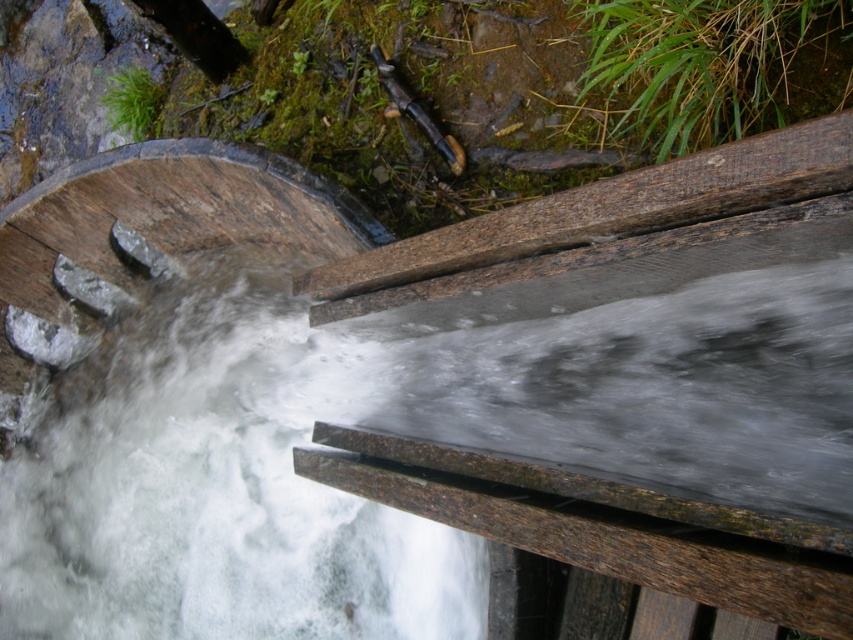
Who is lower down, clear water at center or brown wood rail at center?

clear water at center is below.

Is clear water at center to the right of brown wood rail at center from the viewer's perspective?

Incorrect, clear water at center is not on the right side of brown wood rail at center.

Is point (213, 385) less distant than point (679, 164)?

No, it is behind (679, 164).

I want to click on clear water at center, so click(213, 486).